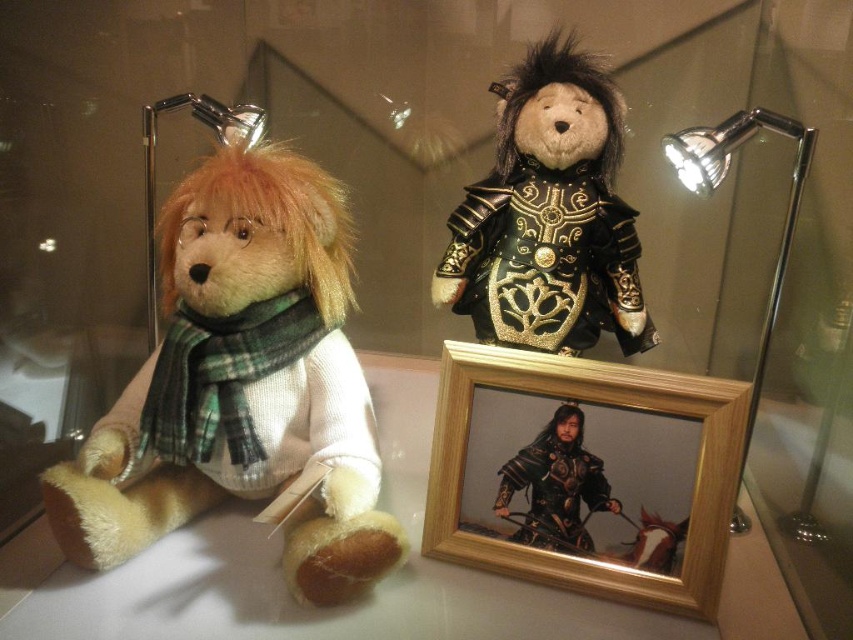
Between fluffy beige teddy bear at left and velvet-like black armor at upper center, which one appears on the right side from the viewer's perspective?

velvet-like black armor at upper center is more to the right.

Locate an element on the screen. fluffy beige teddy bear at left is located at coordinates (242, 385).

Where is `fluffy beige teddy bear at left`? This screenshot has height=640, width=853. fluffy beige teddy bear at left is located at coordinates (242, 385).

Is velvet-like black armor at upper center below wooden photo frame at center?

Incorrect, velvet-like black armor at upper center is not positioned below wooden photo frame at center.

This screenshot has width=853, height=640. In order to click on velvet-like black armor at upper center in this screenshot , I will do `click(549, 218)`.

At what (x,y) coordinates should I click in order to perform the action: click on velvet-like black armor at upper center. Please return your answer as a coordinate pair (x, y). Image resolution: width=853 pixels, height=640 pixels. Looking at the image, I should click on (549, 218).

Who is positioned more to the right, velvet-like black armor at upper center or metallic armor figure at center?

Positioned to the right is velvet-like black armor at upper center.

Does point (511, 224) lie in front of point (535, 545)?

No.

This screenshot has width=853, height=640. In order to click on velvet-like black armor at upper center in this screenshot , I will do 549,218.